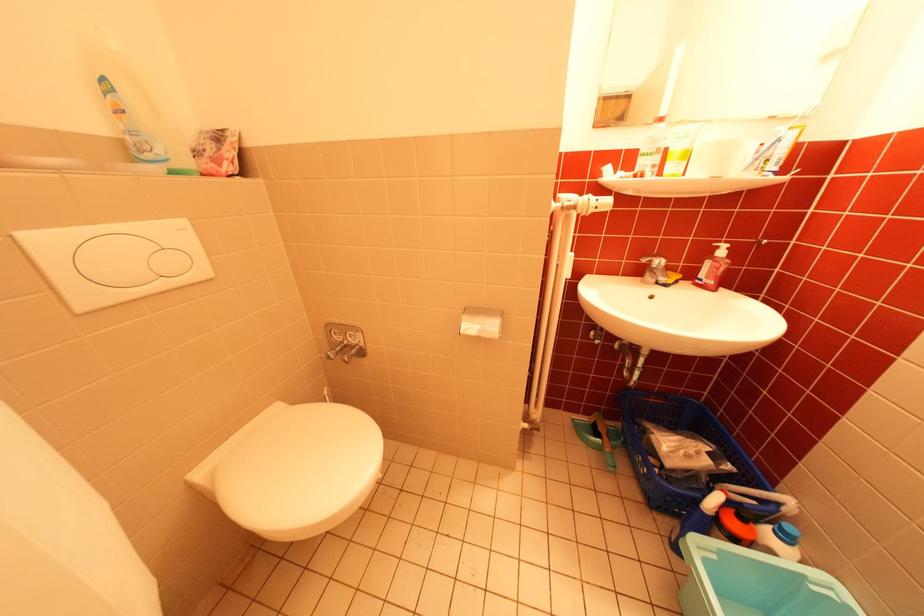
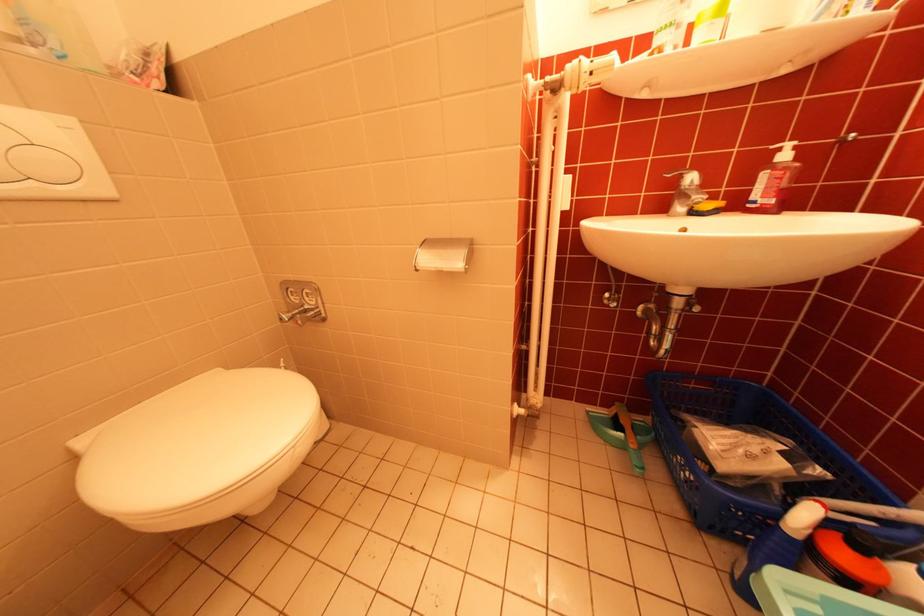
Question: Based on the continuous images, in which direction is the camera rotating? Reply with the corresponding letter.

Choices:
 (A) Left
 (B) Right
 (C) Up
 (D) Down

Answer: (A)